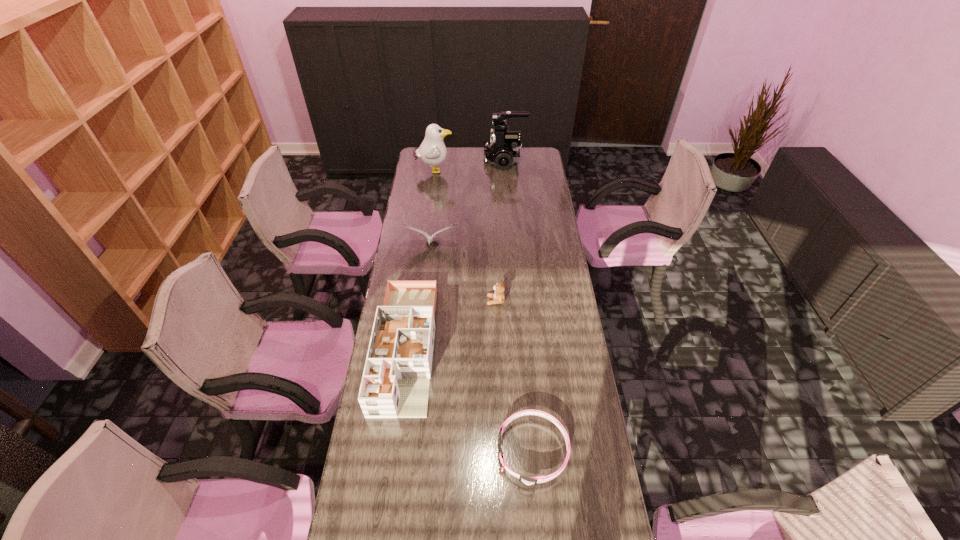
You are a GUI agent. You are given a task and a screenshot of the screen. Output one action in this format:
    pyautogui.click(x=<x>, y=<y>)
    Task: Click on the gull present at the far edge
    The image size is (960, 540).
    Given the screenshot: What is the action you would take?
    pyautogui.click(x=432, y=151)

Locate an element on the screen. This screenshot has height=540, width=960. dollhouse that is positioned at the left edge is located at coordinates (395, 384).

Image resolution: width=960 pixels, height=540 pixels. I want to click on camcorder that is at the right edge, so click(503, 150).

Locate an element on the screen. The image size is (960, 540). dog collar at the right edge is located at coordinates (531, 481).

Image resolution: width=960 pixels, height=540 pixels. I want to click on object present at the far left corner, so click(x=432, y=151).

Identify the location of object that is positioned at the far right corner. (503, 150).

In the image, there is a desktop. Identify the location of vacant space at the far edge. (475, 153).

In the image, there is a desktop. Identify the location of blank space at the left edge. (346, 514).

You are a GUI agent. You are given a task and a screenshot of the screen. Output one action in this format:
    pyautogui.click(x=<x>, y=<y>)
    Task: Click on the vacant space at the right edge of the desktop
    
    Given the screenshot: What is the action you would take?
    pyautogui.click(x=565, y=294)

This screenshot has width=960, height=540. Find the location of `vacant space at the far right corner of the desktop`. vacant space at the far right corner of the desktop is located at coordinates (545, 162).